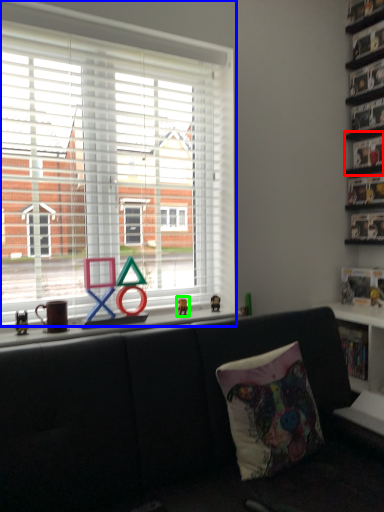
Question: Estimate the real-world distances between objects in this image. Which object is farther from shelf (highlighted by a red box), window (highlighted by a blue box) or miniature (highlighted by a green box)?

Choices:
 (A) window
 (B) miniature

Answer: (B)